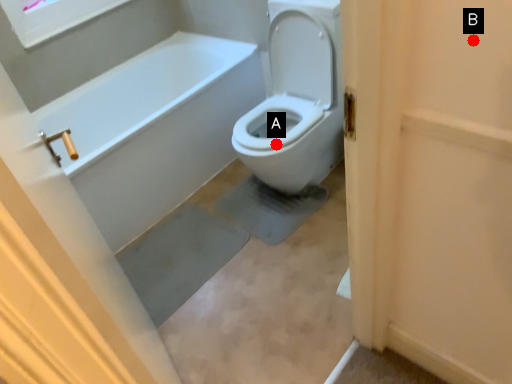
Question: Two points are circled on the image, labeled by A and B beside each circle. Which point is further to the camera?

Choices:
 (A) A is further
 (B) B is further

Answer: (A)